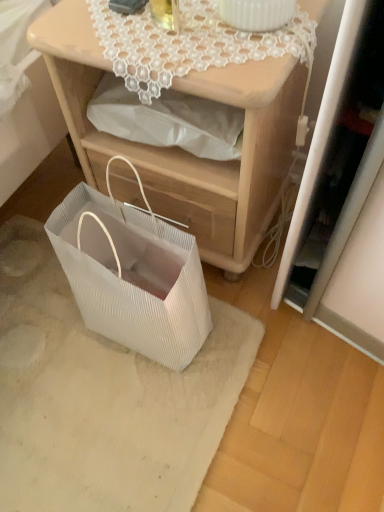
Question: Can you confirm if white lace doily at upper center is thinner than white pleated paper bag at lower left?

Choices:
 (A) no
 (B) yes

Answer: (A)

Question: Is white lace doily at upper center next to white pleated paper bag at lower left and touching it?

Choices:
 (A) no
 (B) yes

Answer: (A)

Question: From a real-world perspective, does white lace doily at upper center sit lower than white pleated paper bag at lower left?

Choices:
 (A) yes
 (B) no

Answer: (B)

Question: Could you tell me if white lace doily at upper center is turned towards white pleated paper bag at lower left?

Choices:
 (A) yes
 (B) no

Answer: (B)

Question: Could white pleated paper bag at lower left be considered to be inside white lace doily at upper center?

Choices:
 (A) yes
 (B) no

Answer: (B)

Question: Is white pleated paper bag at lower left wider or thinner than white textured mat at lower left?

Choices:
 (A) wide
 (B) thin

Answer: (B)

Question: Considering the positions of white pleated paper bag at lower left and white textured mat at lower left in the image, is white pleated paper bag at lower left bigger or smaller than white textured mat at lower left?

Choices:
 (A) small
 (B) big

Answer: (B)

Question: From the image's perspective, is white pleated paper bag at lower left positioned above or below white textured mat at lower left?

Choices:
 (A) above
 (B) below

Answer: (A)

Question: Is white pleated paper bag at lower left situated inside white textured mat at lower left or outside?

Choices:
 (A) inside
 (B) outside

Answer: (B)

Question: Relative to white lace doily at upper center, is white textured mat at lower left in front or behind?

Choices:
 (A) front
 (B) behind

Answer: (B)

Question: Based on their sizes in the image, would you say white textured mat at lower left is bigger or smaller than white lace doily at upper center?

Choices:
 (A) small
 (B) big

Answer: (B)

Question: From the image's perspective, is white textured mat at lower left positioned above or below white lace doily at upper center?

Choices:
 (A) above
 (B) below

Answer: (B)

Question: From a real-world perspective, is white textured mat at lower left above or below white lace doily at upper center?

Choices:
 (A) above
 (B) below

Answer: (B)

Question: Is white pleated paper bag at lower left situated inside matte wood nightstand at center or outside?

Choices:
 (A) inside
 (B) outside

Answer: (B)

Question: From a real-world perspective, is white pleated paper bag at lower left positioned above or below matte wood nightstand at center?

Choices:
 (A) above
 (B) below

Answer: (B)